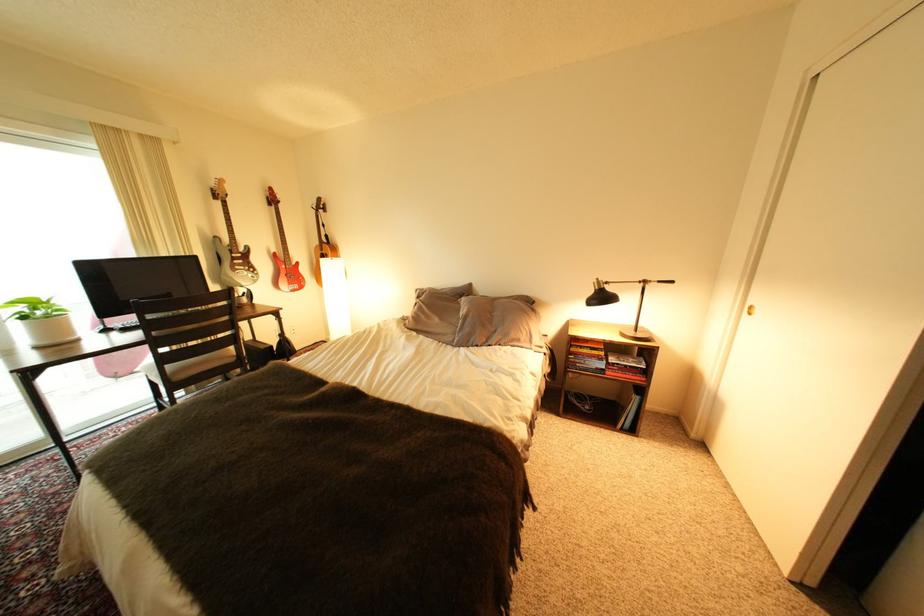
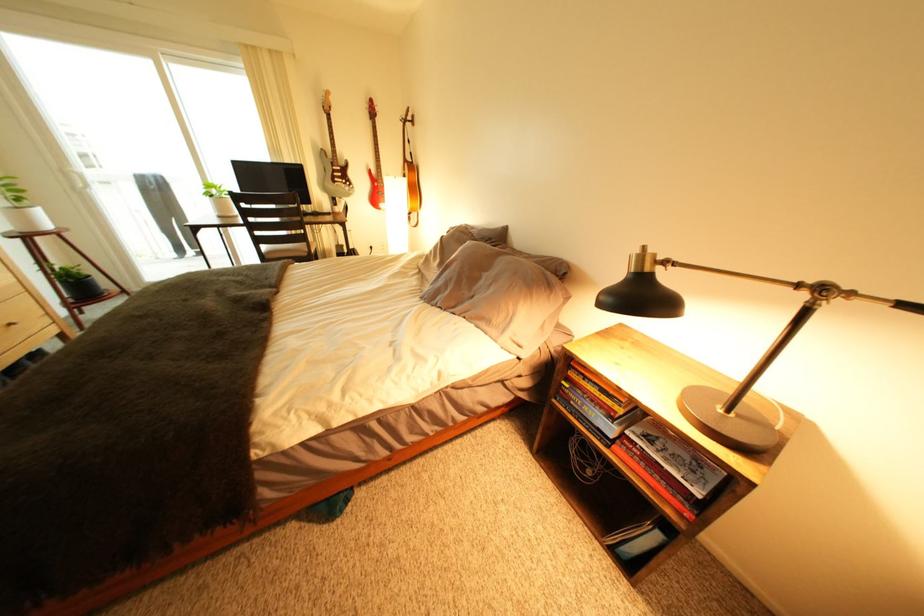
In the second image, find the point that corresponds to point (657, 369) in the first image.

(712, 496)